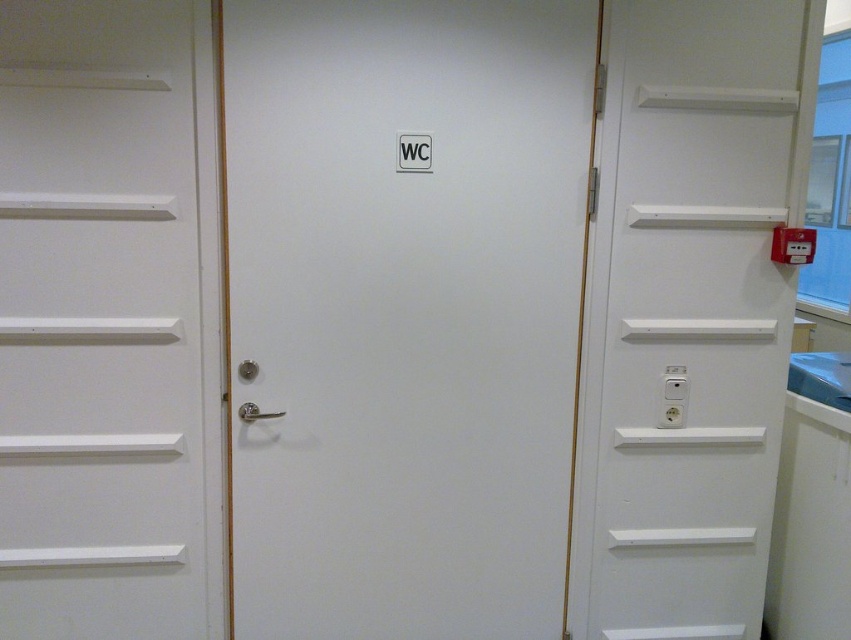
Is white matte door at center below white matte door at left?

Actually, white matte door at center is above white matte door at left.

Which is in front, point (357, 387) or point (67, 433)?

Point (67, 433) is in front.

Is point (512, 280) positioned after point (56, 216)?

Yes, point (512, 280) is farther from viewer.

I want to click on white matte door at center, so click(x=404, y=310).

Is white matte door at center behind white matte door at right?

No, white matte door at center is in front of white matte door at right.

Does white matte door at center appear over white matte door at right?

Indeed, white matte door at center is positioned over white matte door at right.

Identify the location of white matte door at center. (404, 310).

Find the location of a particular element. white matte door at center is located at coordinates (404, 310).

Can you confirm if white matte door at left is positioned above white matte door at right?

Yes.

Who is higher up, white matte door at left or white matte door at right?

Positioned higher is white matte door at left.

Find the location of a particular element. white matte door at left is located at coordinates (107, 321).